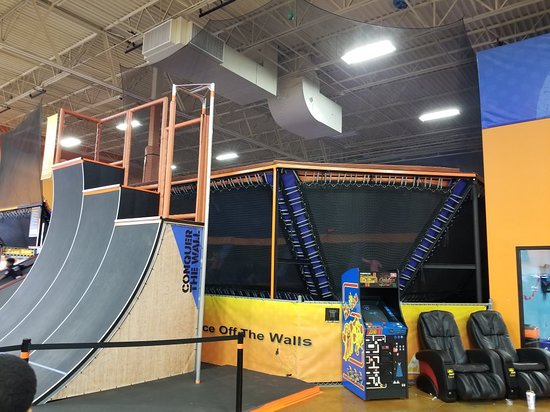
Locate an element on the screen. The height and width of the screenshot is (412, 550). chair is located at coordinates (446, 330).